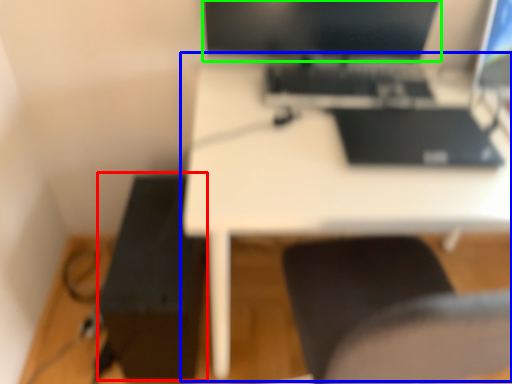
Question: Based on their relative distances, which object is nearer to printer (highlighted by a red box)? Choose from table (highlighted by a blue box) and computer monitor (highlighted by a green box).

Choices:
 (A) table
 (B) computer monitor

Answer: (A)